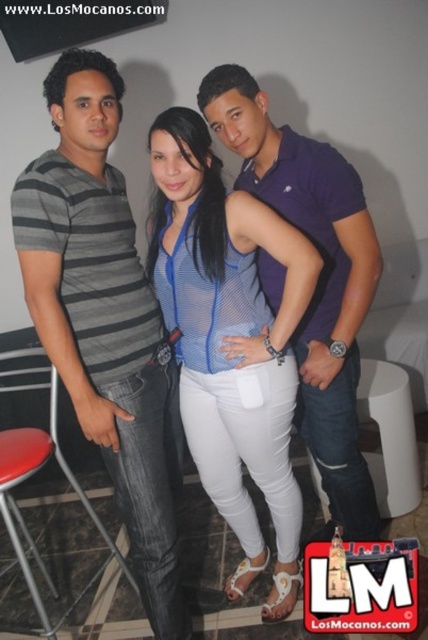
You are a photographer trying to capture a photo of the two people in the image. You notice the gray striped shirt at left and the purple cotton polo shirt at center. Which shirt is positioned lower in the frame?

The gray striped shirt at left is positioned lower in the frame because it is below the purple cotton polo shirt at center.

You are a photographer setting up for a group photo. You need to ensure that the gray striped shirt at left and the purple cotton polo shirt at center are at least 60 centimeters apart for proper framing. Based on the current positioning, is this requirement met?

The distance between the gray striped shirt at left and the purple cotton polo shirt at center is 50.98 centimeters, which is less than the required 60 centimeters. Therefore, the requirement is not met, and they need to move further apart.